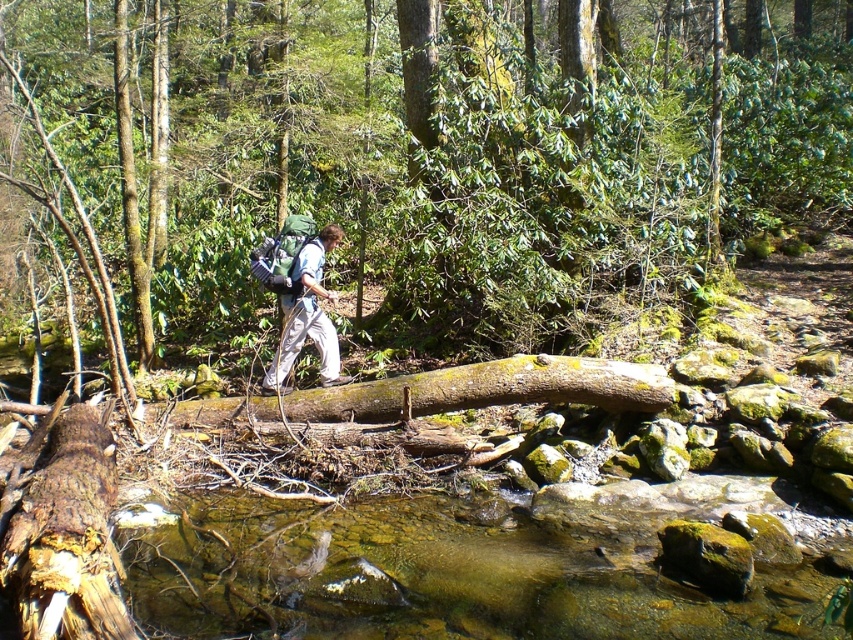
Question: Which point is farther to the camera?

Choices:
 (A) brown rough tree trunk at lower left
 (B) green fabric backpack at center

Answer: (B)

Question: Is brown rough tree trunk at lower left in front of green fabric backpack at center?

Choices:
 (A) yes
 (B) no

Answer: (A)

Question: In this image, where is brown rough tree trunk at lower left located relative to green fabric backpack at center?

Choices:
 (A) right
 (B) left

Answer: (B)

Question: Which point appears farthest from the camera in this image?

Choices:
 (A) (514, 273)
 (B) (82, 504)

Answer: (A)

Question: Which point is farther to the camera?

Choices:
 (A) green fabric backpack at center
 (B) brown rough tree trunk at lower left

Answer: (A)

Question: Is brown rough tree trunk at lower left smaller than green fabric backpack at center?

Choices:
 (A) yes
 (B) no

Answer: (B)